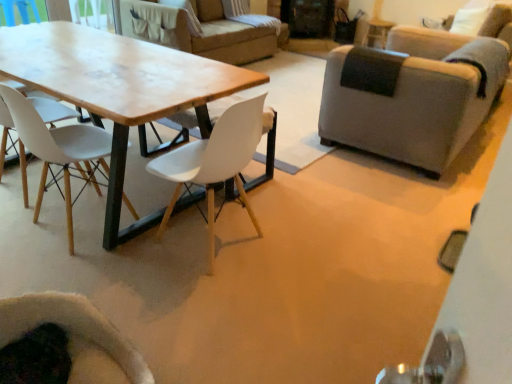
Question: Considering the relative positions of white matte chair at left, which is counted as the fourth chair, starting from the right, and velvet dark green armchair at lower left, which is the 2th chair in left-to-right order, in the image provided, is white matte chair at left, which is counted as the fourth chair, starting from the right, to the left or to the right of velvet dark green armchair at lower left, which is the 2th chair in left-to-right order,?

Choices:
 (A) left
 (B) right

Answer: (A)

Question: From the image's perspective, relative to velvet dark green armchair at lower left, which is the 2th chair in left-to-right order, is white matte chair at left, which is counted as the fourth chair, starting from the right, above or below?

Choices:
 (A) below
 (B) above

Answer: (B)

Question: Which object is the farthest from the wooden table at center?

Choices:
 (A) white matte chair at center, the 2th chair in the right-to-left sequence
 (B) white matte chair at left, which is counted as the fourth chair, starting from the right
 (C) velvet dark green armchair at lower left, which is the 2th chair in left-to-right order
 (D) gray fabric armchair at right, which is counted as the first chair, starting from the right

Answer: (D)

Question: Which object is the closest to the wooden table at center?

Choices:
 (A) white matte chair at left, which is the first chair in left-to-right order
 (B) white matte chair at center, the 2th chair in the right-to-left sequence
 (C) gray fabric armchair at right, which is counted as the first chair, starting from the right
 (D) velvet dark green armchair at lower left, which is the 2th chair in left-to-right order

Answer: (A)